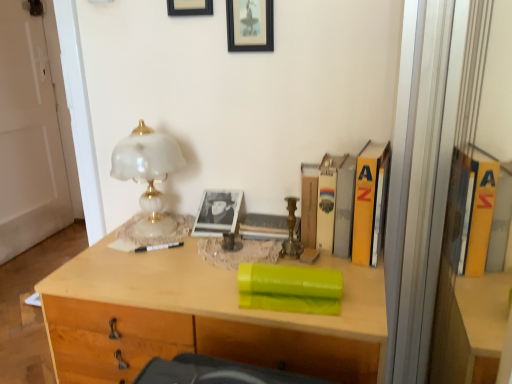
At what (x,y) coordinates should I click in order to perform the action: click on space that is in front of green matte book at center, the 2th book positioned from the right. Please return your answer as a coordinate pair (x, y). This screenshot has width=512, height=384. Looking at the image, I should click on (298, 322).